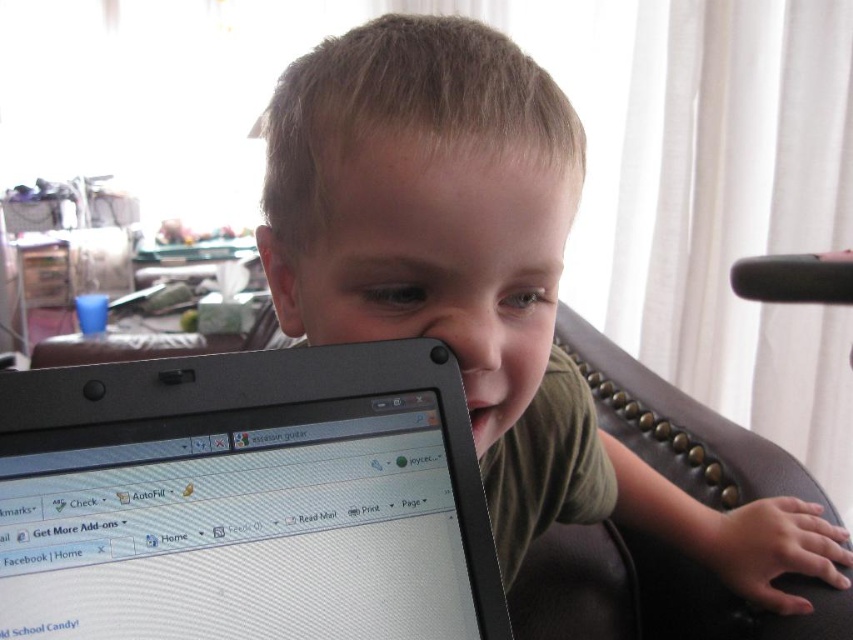
Question: Does black plastic laptop at center appear on the left side of matte black laptop at center?

Choices:
 (A) no
 (B) yes

Answer: (B)

Question: Can you confirm if black plastic laptop at center is bigger than matte black laptop at center?

Choices:
 (A) yes
 (B) no

Answer: (B)

Question: Which point is farther to the camera?

Choices:
 (A) (207, 529)
 (B) (532, 333)

Answer: (B)

Question: Is black plastic laptop at center further to camera compared to matte black laptop at center?

Choices:
 (A) yes
 (B) no

Answer: (B)